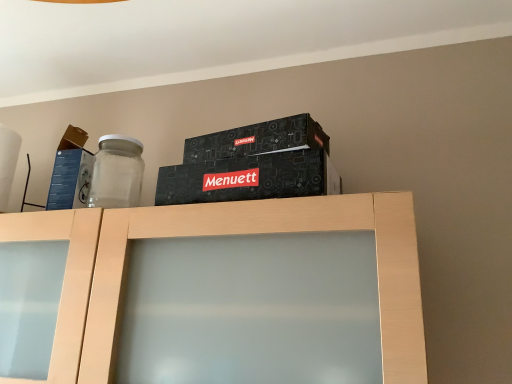
Question: In the image, is blue cardboard box at left positioned in front of or behind light wood cabinet at center?

Choices:
 (A) front
 (B) behind

Answer: (B)

Question: Looking at the image, does blue cardboard box at left seem bigger or smaller compared to light wood cabinet at center?

Choices:
 (A) small
 (B) big

Answer: (A)

Question: Considering the positions of blue cardboard box at left and light wood cabinet at center in the image, is blue cardboard box at left wider or thinner than light wood cabinet at center?

Choices:
 (A) thin
 (B) wide

Answer: (A)

Question: Is light wood cabinet at center taller or shorter than blue cardboard box at left?

Choices:
 (A) short
 (B) tall

Answer: (B)

Question: Visually, is light wood cabinet at center positioned to the left or to the right of blue cardboard box at left?

Choices:
 (A) right
 (B) left

Answer: (A)

Question: Considering the positions of light wood cabinet at center and blue cardboard box at left in the image, is light wood cabinet at center bigger or smaller than blue cardboard box at left?

Choices:
 (A) big
 (B) small

Answer: (A)

Question: Is point (42, 221) closer or farther from the camera than point (78, 190)?

Choices:
 (A) closer
 (B) farther

Answer: (A)